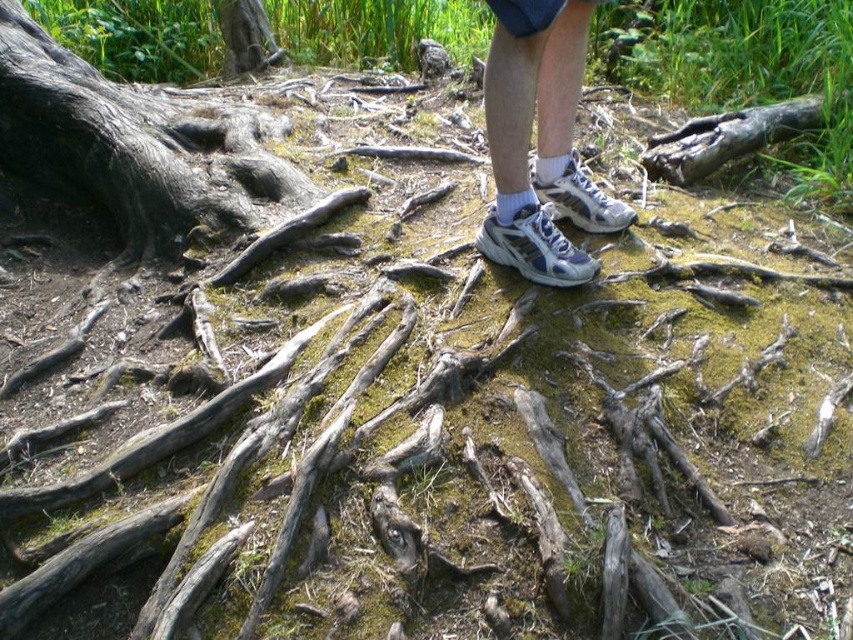
Question: Which point appears farthest from the camera in this image?

Choices:
 (A) (51, 44)
 (B) (509, 36)

Answer: (A)

Question: Can you confirm if dark gray rough bark at left is positioned above white mesh sneakers at center?

Choices:
 (A) yes
 (B) no

Answer: (A)

Question: Which object is closer to the camera taking this photo?

Choices:
 (A) dark gray rough bark at left
 (B) white mesh sneakers at center

Answer: (B)

Question: Can you confirm if dark gray rough bark at left is positioned above white mesh sneakers at center?

Choices:
 (A) no
 (B) yes

Answer: (B)

Question: Can you confirm if dark gray rough bark at left is positioned above white mesh sneakers at center?

Choices:
 (A) yes
 (B) no

Answer: (A)